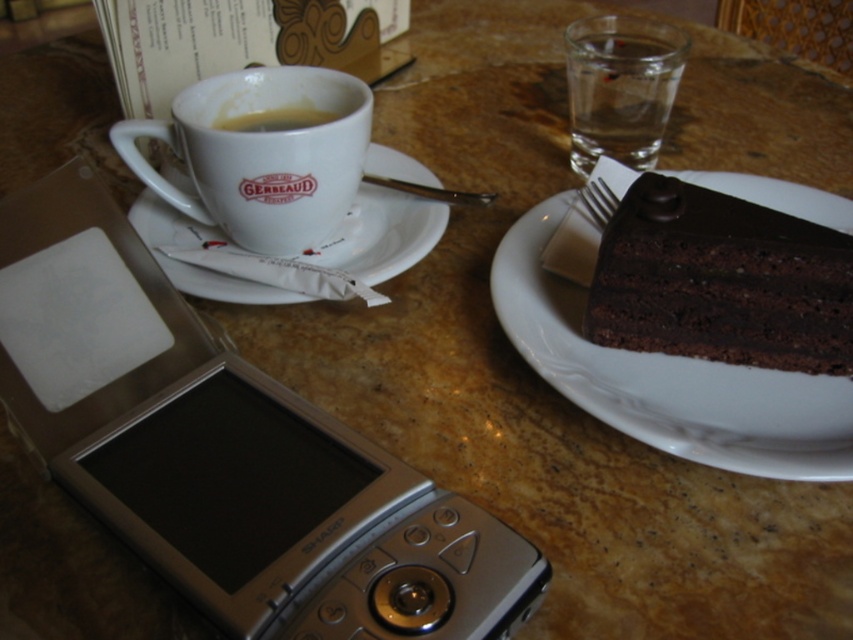
Question: Considering the real-world distances, which object is farthest from the white ceramic saucer at upper left?

Choices:
 (A) matte ceramic cup at upper left
 (B) metallic silver fork at upper right
 (C) clear glass water at upper right

Answer: (C)

Question: Among these points, which one is farthest from the camera?

Choices:
 (A) (616, 196)
 (B) (709, 275)

Answer: (A)

Question: Is dark chocolate cake at right above metallic silver fork at upper right?

Choices:
 (A) no
 (B) yes

Answer: (A)

Question: Is clear glass water at upper right below matte ceramic cup at upper left?

Choices:
 (A) yes
 (B) no

Answer: (B)

Question: Based on their relative distances, which object is nearer to the metallic silver fork at upper right?

Choices:
 (A) dark chocolate cake at right
 (B) white ceramic saucer at upper left
 (C) matte ceramic cup at upper left
 (D) clear glass water at upper right

Answer: (A)

Question: Is white ceramic mug at upper left smaller than clear glass water at upper right?

Choices:
 (A) yes
 (B) no

Answer: (B)